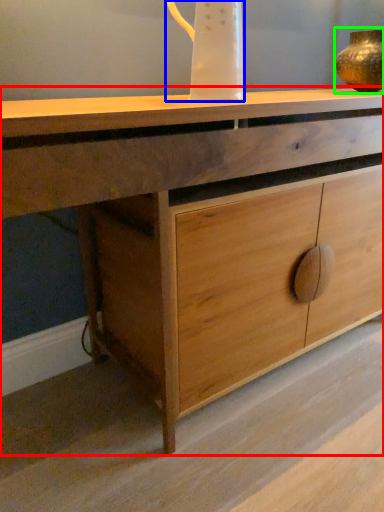
Question: Based on their relative distances, which object is nearer to chest of drawers (highlighted by a red box)? Choose from jug (highlighted by a blue box) and candle holder (highlighted by a green box).

Choices:
 (A) jug
 (B) candle holder

Answer: (A)